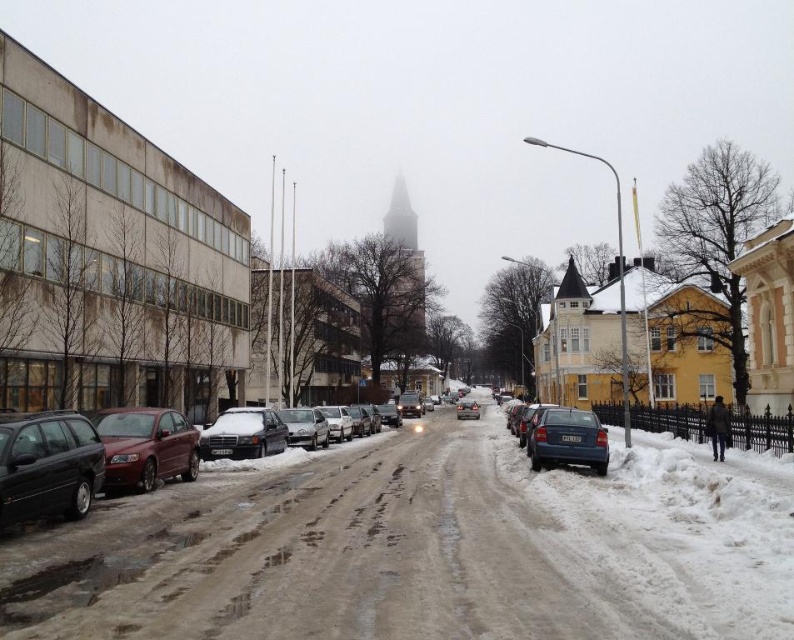
Question: Can you confirm if blue matte car at center-right is wider than matte black sedan at center?

Choices:
 (A) no
 (B) yes

Answer: (A)

Question: Among these points, which one is farthest from the camera?

Choices:
 (A) (638, 509)
 (B) (553, 461)
 (C) (461, 403)

Answer: (C)

Question: Which point appears closest to the camera in this image?

Choices:
 (A) (478, 404)
 (B) (347, 515)

Answer: (B)

Question: Is shiny black car at lower left bigger than satin silver sedan at center?

Choices:
 (A) yes
 (B) no

Answer: (B)

Question: Does shiny black car at lower left have a lesser width compared to satin burgundy sedan at left?

Choices:
 (A) no
 (B) yes

Answer: (B)

Question: Which of the following is the farthest from the observer?

Choices:
 (A) (174, 522)
 (B) (538, 426)
 (C) (137, 413)

Answer: (B)